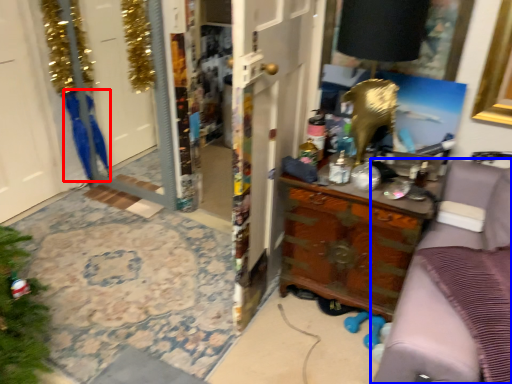
Question: Which point is closer to the camera, robe (highlighted by a red box) or furniture (highlighted by a blue box)?

Choices:
 (A) robe
 (B) furniture

Answer: (B)